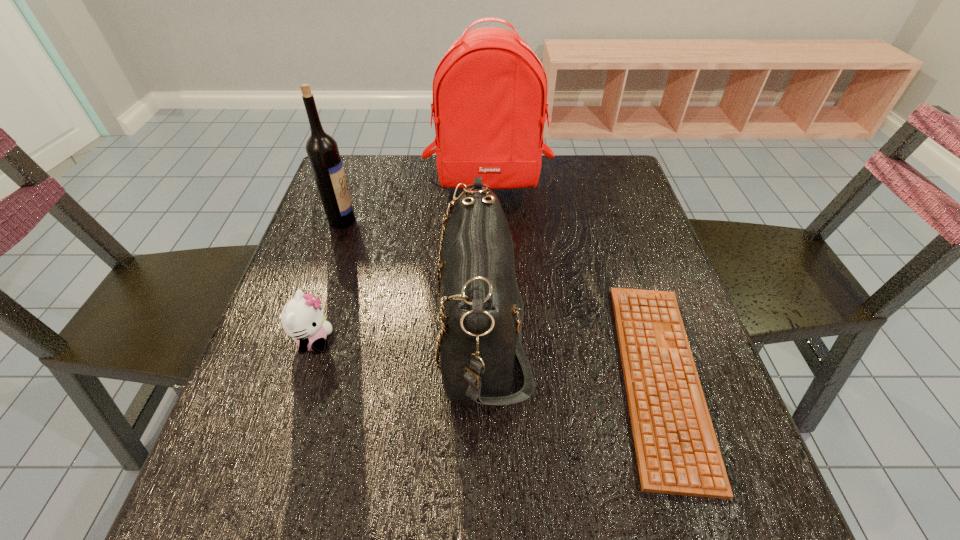
Image resolution: width=960 pixels, height=540 pixels. I want to click on free space that is in between the tallest object and the rightmost object, so click(574, 280).

You are a GUI agent. You are given a task and a screenshot of the screen. Output one action in this format:
    pyautogui.click(x=<x>, y=<y>)
    Task: Click on the free space that is in between the handbag and the rightmost object
    Image resolution: width=960 pixels, height=540 pixels.
    Given the screenshot: What is the action you would take?
    pyautogui.click(x=571, y=353)

At what (x,y) coordinates should I click in order to perform the action: click on vacant space that's between the third shortest object and the rightmost object. Please return your answer as a coordinate pair (x, y). Looking at the image, I should click on (571, 353).

Identify the location of vacant space that is in between the farthest object and the rightmost object. (574, 280).

This screenshot has width=960, height=540. In order to click on object identified as the third closest to the backpack in this screenshot , I will do `click(677, 451)`.

Select which object appears as the fourth closest to the fourth shortest object. Please provide its 2D coordinates. Your answer should be formatted as a tuple, i.e. [(x, y)], where the tuple contains the x and y coordinates of a point satisfying the conditions above.

[(677, 451)]

Find the location of a particular element. This screenshot has width=960, height=540. free point that satisfies the following two spatial constraints: 1. on the main compartment of the farthest object; 2. at the front of the third tallest object with chain and zipper is located at coordinates (x=492, y=328).

Identify the location of free point that satisfies the following two spatial constraints: 1. on the main compartment of the tallest object; 2. at the front of the third tallest object with chain and zipper. The height and width of the screenshot is (540, 960). (492, 328).

In order to click on free space that satisfies the following two spatial constraints: 1. on the front-facing side of the second shortest object; 2. on the back side of the shortest object in this screenshot , I will do `click(301, 377)`.

Identify the location of vacant point that satisfies the following two spatial constraints: 1. on the label of the fourth shortest object; 2. on the right side of the computer keyboard. The width and height of the screenshot is (960, 540). (288, 377).